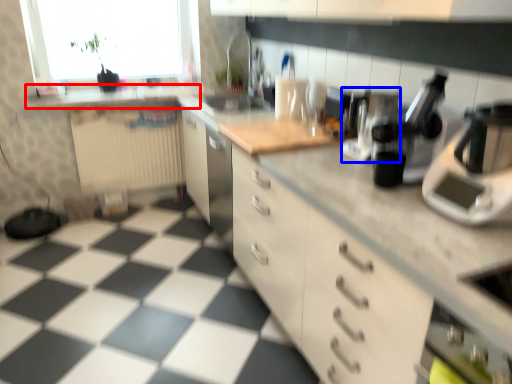
Question: Which of the following is the farthest to the observer, counter top (highlighted by a red box) or coffee machine (highlighted by a blue box)?

Choices:
 (A) counter top
 (B) coffee machine

Answer: (A)